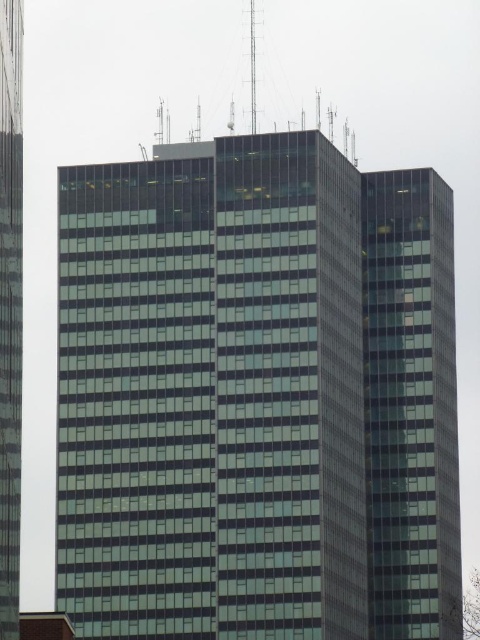
You are standing at the base of the green glass building at center. You want to take a photo of the entire building without any obstructions. Considering the building is 113.86 meters away from you, what is the minimum focal length required for your camera lens to capture the entire height of the building in the frame?

The minimum focal length required to capture the entire height of the green glass building at center would depend on the sensor size of the camera and the building height. However, since the distance to the building is 113.86 meters, a wide angle lens with a focal length of 24mm or lower would likely be necessary to fit the entire height into the frame.

You are standing in front of a tall modern skyscraper. There is a point marked at coordinates (256, 396). Based on the scene description, what object does this point most likely correspond to?

The point at coordinates (256, 396) corresponds to the green glass building at center, as indicated by the Objects Description.

You are standing on the sidewalk in front of the green glass building at center. You want to take a photo of the transparent glass building at left. Which direction should you turn to ensure it is fully visible?

The transparent glass building at left is behind the green glass building at center, so you should turn around or move to a position where the green glass building at center is no longer blocking your view.